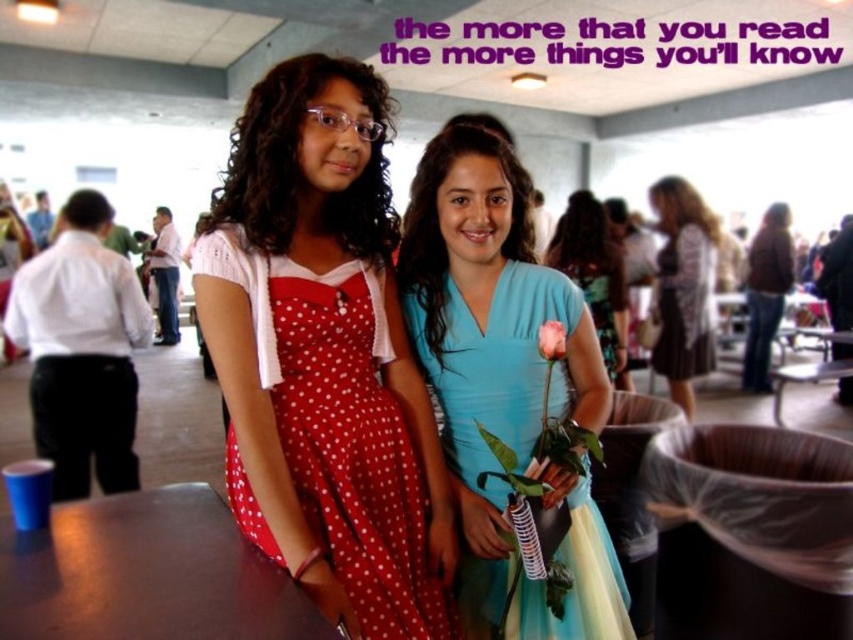
You are a photographer at the event and need to capture a group photo. The red polka dot dress at center and the brown leather jacket at center are in the frame. Which of these two items is narrower?

The red polka dot dress at center is narrower than the brown leather jacket at center.

You are organizing a photo shoot and need to arrange two dresses in the center of the frame. The teal satin dress at center and the matte blue dress at center must be placed side by side. Given their sizes, which dress should be positioned closer to the edge to ensure both fit comfortably within the frame?

The teal satin dress at center occupies less space than the matte blue dress at center, so the larger matte blue dress at center should be placed closer to the center of the frame, while the smaller teal satin dress at center can be positioned closer to the edge to ensure both fit comfortably within the frame.

You are organizing a clothing store display and need to arrange the red polka dot dress at center and the brown leather jacket at center on a mannequin. Which item should be placed higher up on the mannequin to ensure proper visibility?

The red polka dot dress at center is smaller than the brown leather jacket at center, so placing the smaller dress higher up on the mannequin will ensure both items are visible without one blocking the other.